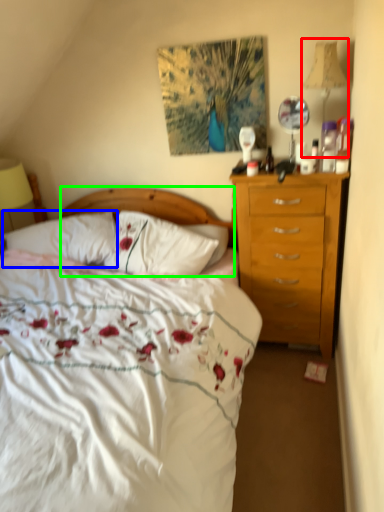
Question: Which object is the closest to the bedside lamp (highlighted by a red box)? Choose among these: pillow (highlighted by a blue box) or headboard (highlighted by a green box).

Choices:
 (A) pillow
 (B) headboard

Answer: (B)